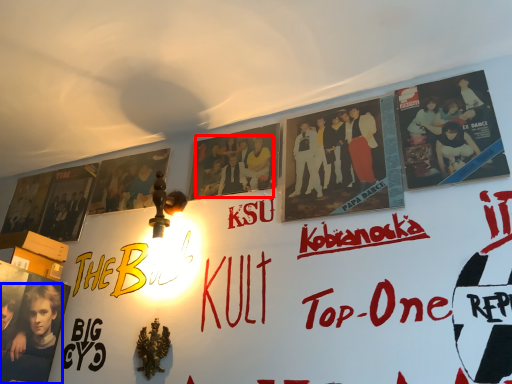
Question: Which of the following is the farthest to the observer, person (highlighted by a red box) or person (highlighted by a blue box)?

Choices:
 (A) person
 (B) person

Answer: (A)